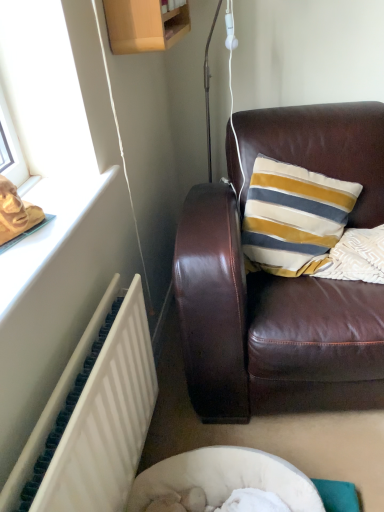
Question: Is brown leather couch at center turned away from white textured radiator at lower left?

Choices:
 (A) no
 (B) yes

Answer: (A)

Question: Does brown leather couch at center have a smaller size compared to white textured radiator at lower left?

Choices:
 (A) no
 (B) yes

Answer: (A)

Question: From the image's perspective, would you say brown leather couch at center is positioned over white textured radiator at lower left?

Choices:
 (A) no
 (B) yes

Answer: (B)

Question: Considering the relative sizes of brown leather couch at center and white textured radiator at lower left in the image provided, is brown leather couch at center thinner than white textured radiator at lower left?

Choices:
 (A) yes
 (B) no

Answer: (B)

Question: Does brown leather couch at center have a greater width compared to white textured radiator at lower left?

Choices:
 (A) no
 (B) yes

Answer: (B)

Question: Is brown leather couch at center bigger than white textured radiator at lower left?

Choices:
 (A) yes
 (B) no

Answer: (A)

Question: Is white textured radiator at lower left surrounding brown leather couch at center?

Choices:
 (A) no
 (B) yes

Answer: (A)

Question: Is white textured radiator at lower left facing towards brown leather couch at center?

Choices:
 (A) yes
 (B) no

Answer: (B)

Question: From the image's perspective, is white textured radiator at lower left under brown leather couch at center?

Choices:
 (A) no
 (B) yes

Answer: (B)

Question: Is white textured radiator at lower left next to brown leather couch at center?

Choices:
 (A) no
 (B) yes

Answer: (A)

Question: Is white textured radiator at lower left positioned before brown leather couch at center?

Choices:
 (A) yes
 (B) no

Answer: (A)

Question: Is white textured radiator at lower left wider than brown leather couch at center?

Choices:
 (A) yes
 (B) no

Answer: (B)

Question: In the image, is white textured radiator at lower left positioned in front of or behind brown leather couch at center?

Choices:
 (A) front
 (B) behind

Answer: (A)